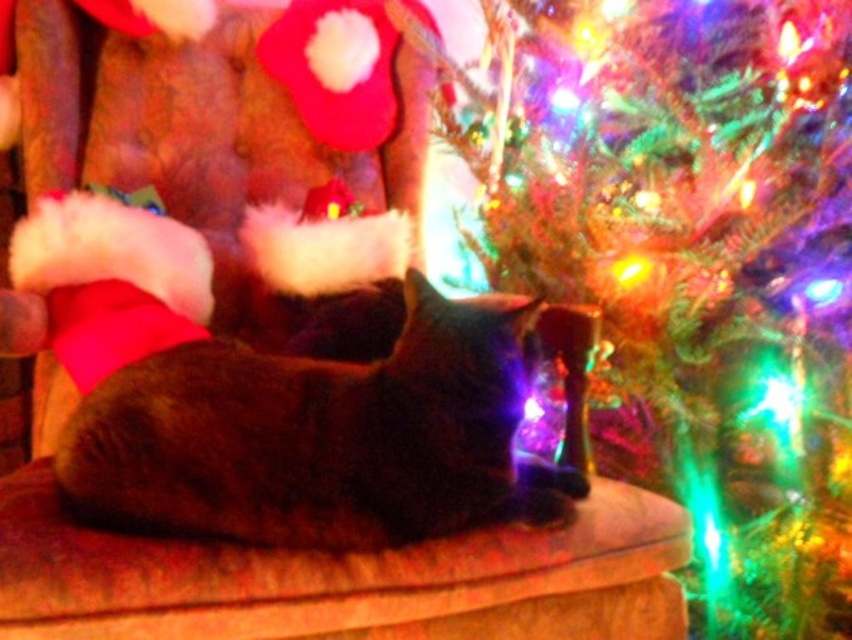
You are an interior designer working on a Christmas decoration project. You need to place a new ornament exactly at the coordinates where the shiny green needles at upper right are located. What are the coordinates where you should place the new ornament?

The coordinates for the shiny green needles at upper right are at point (695, 264), so you should place the new ornament at those coordinates.